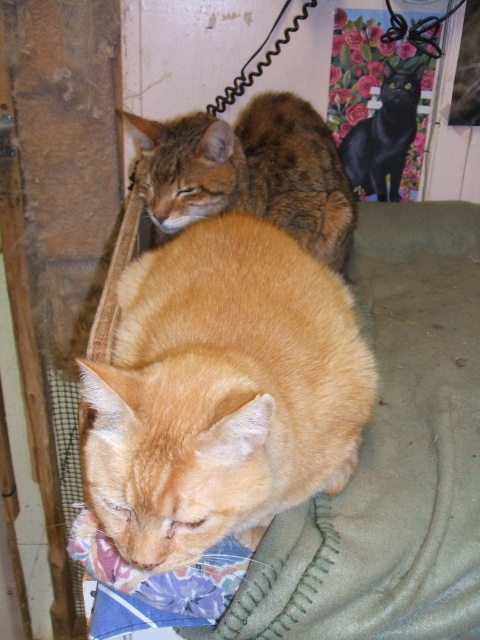
Does orange fur cat at center have a smaller size compared to black glossy cat at upper center?

No, orange fur cat at center is not smaller than black glossy cat at upper center.

Is the position of orange fur cat at center less distant than that of black glossy cat at upper center?

That is True.

Is point (149, 524) closer to camera compared to point (348, 154)?

Yes, point (149, 524) is in front of point (348, 154).

At what (x,y) coordinates should I click in order to perform the action: click on orange fur cat at center. Please return your answer as a coordinate pair (x, y). The width and height of the screenshot is (480, 640). Looking at the image, I should click on (222, 392).

Which is above, tabby fur cat at upper left or black glossy cat at upper center?

black glossy cat at upper center is above.

Who is more forward, (320, 180) or (395, 115)?

Positioned in front is point (320, 180).

At what (x,y) coordinates should I click in order to perform the action: click on tabby fur cat at upper left. Please return your answer as a coordinate pair (x, y). The width and height of the screenshot is (480, 640). Looking at the image, I should click on (250, 172).

Who is higher up, orange fur cat at center or tabby fur cat at upper left?

tabby fur cat at upper left

What do you see at coordinates (222, 392) in the screenshot? This screenshot has height=640, width=480. I see `orange fur cat at center` at bounding box center [222, 392].

Locate an element on the screen. This screenshot has height=640, width=480. orange fur cat at center is located at coordinates (222, 392).